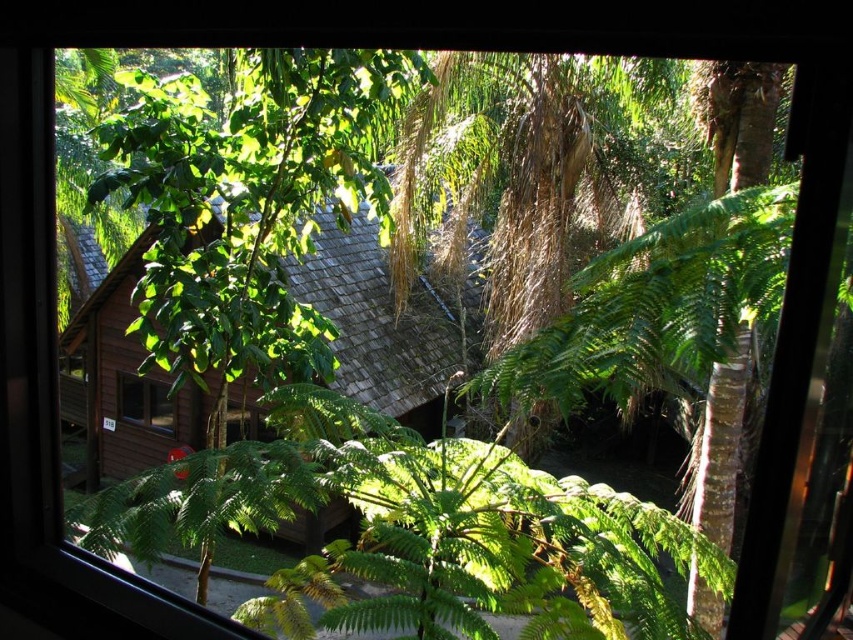
Question: Which object is the farthest from the green leafy fern at center?

Choices:
 (A) brown wooden hut at center
 (B) matte wooden window at center

Answer: (B)

Question: Can you confirm if brown wooden hut at center is positioned below matte wooden window at center?

Choices:
 (A) no
 (B) yes

Answer: (A)

Question: Which object is the farthest from the brown wooden hut at center?

Choices:
 (A) green leafy fern at center
 (B) matte wooden window at center

Answer: (A)

Question: Among these points, which one is nearest to the camera?

Choices:
 (A) (155, 417)
 (B) (344, 234)

Answer: (A)

Question: From the image, what is the correct spatial relationship of green leafy fern at center in relation to brown wooden hut at center?

Choices:
 (A) left
 (B) right

Answer: (B)

Question: Does green leafy fern at center appear under matte wooden window at center?

Choices:
 (A) no
 (B) yes

Answer: (A)